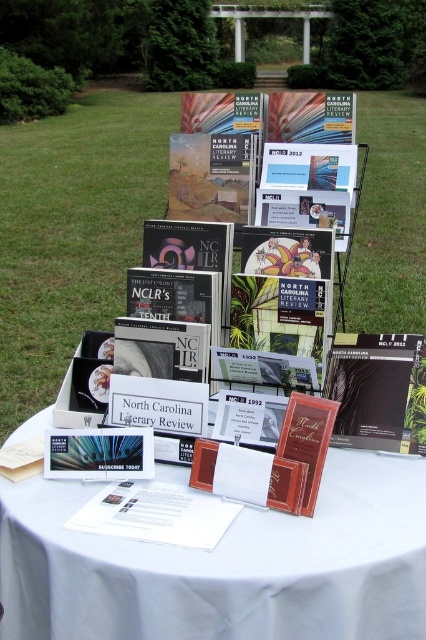
Question: Is matte black book at center closer to camera compared to matte red card at center?

Choices:
 (A) yes
 (B) no

Answer: (B)

Question: Observing the image, what is the correct spatial positioning of matte black book at center in reference to matte red card at center?

Choices:
 (A) below
 (B) above

Answer: (B)

Question: Among these objects, which one is nearest to the camera?

Choices:
 (A) matte black book at center
 (B) matte red card at center
 (C) white paper at center

Answer: (C)

Question: Which object is the closest to the white cloth at center?

Choices:
 (A) matte black book at center
 (B) white paper at center
 (C) matte red card at center

Answer: (B)

Question: In this image, where is white cloth at center located relative to matte black book at center?

Choices:
 (A) left
 (B) right

Answer: (A)

Question: Which point is closer to the camera?

Choices:
 (A) (131, 561)
 (B) (371, 413)
 (C) (146, 529)

Answer: (A)